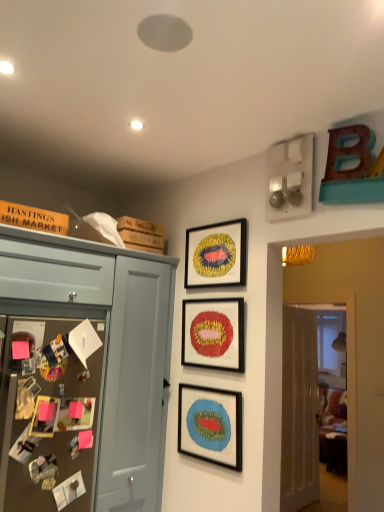
Question: From a real-world perspective, is matte black picture frame at center, the third picture frame viewed from the top, above or below matte blue cabinet at left?

Choices:
 (A) below
 (B) above

Answer: (A)

Question: Is matte black picture frame at center, the 1th picture frame from the bottom, wider or thinner than matte blue cabinet at left?

Choices:
 (A) thin
 (B) wide

Answer: (A)

Question: Based on their relative distances, which object is nearer to the matte blue cabinet at left?

Choices:
 (A) white glossy door at right
 (B) matte black picture frame at center, the third picture frame viewed from the top
 (C) matte blue cabinet at left
 (D) matte red picture frame at center, which appears as the second picture frame when ordered from the bottom
 (E) gold textured frame at upper center, which is the third picture frame in bottom-to-top order

Answer: (C)

Question: Based on their relative distances, which object is nearer to the matte red picture frame at center, the 2th picture frame when ordered from top to bottom?

Choices:
 (A) matte black picture frame at center, the third picture frame viewed from the top
 (B) brown textured bulletin board at left
 (C) white glossy door at right
 (D) gold textured frame at upper center, placed as the first picture frame when sorted from top to bottom
 (E) matte blue cabinet at left

Answer: (D)